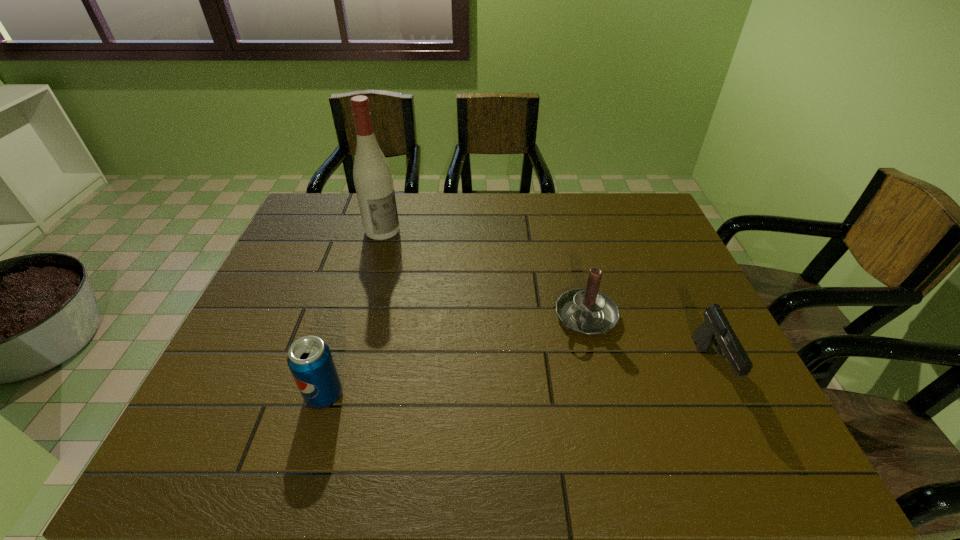
Where is `pop soda`? pop soda is located at coordinates (310, 360).

At what (x,y) coordinates should I click in order to perform the action: click on the rightmost object. Please return your answer as a coordinate pair (x, y). Looking at the image, I should click on (716, 327).

I want to click on pistol, so click(x=716, y=327).

What are the coordinates of `candle` in the screenshot? It's located at 587,311.

The height and width of the screenshot is (540, 960). I want to click on alcohol, so click(372, 175).

At what (x,y) coordinates should I click in order to perform the action: click on the farthest object. Please return your answer as a coordinate pair (x, y). This screenshot has width=960, height=540. Looking at the image, I should click on (372, 175).

Image resolution: width=960 pixels, height=540 pixels. I want to click on free region located on the left of the pop soda, so click(259, 395).

What are the coordinates of `blank space located 0.070m on the side of the candle with the handle loop` in the screenshot? It's located at (548, 348).

At what (x,y) coordinates should I click in order to perform the action: click on blank space located on the side of the candle with the handle loop. Please return your answer as a coordinate pair (x, y). Image resolution: width=960 pixels, height=540 pixels. Looking at the image, I should click on (535, 360).

Find the location of a particular element. Image resolution: width=960 pixels, height=540 pixels. vacant space located on the side of the candle with the handle loop is located at coordinates (492, 396).